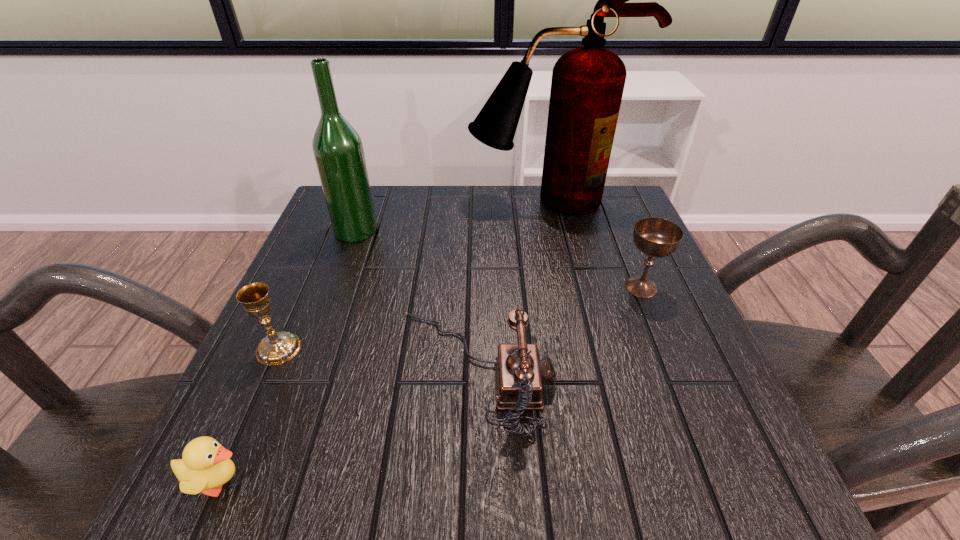
The width and height of the screenshot is (960, 540). I want to click on vacant area in the image that satisfies the following two spatial constraints: 1. at the nozzle of the farthest object; 2. on the dial of the telephone, so click(x=586, y=371).